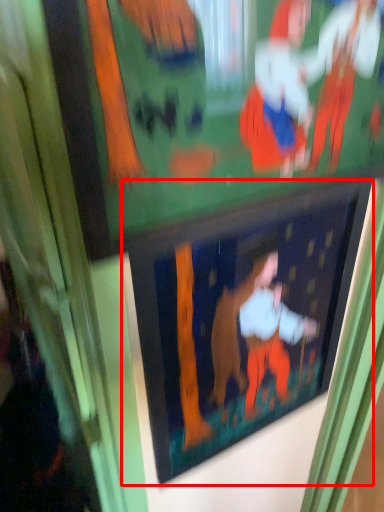
Question: Where is picture frame (annotated by the red box) located in relation to bulletin board in the image?

Choices:
 (A) left
 (B) right

Answer: (B)